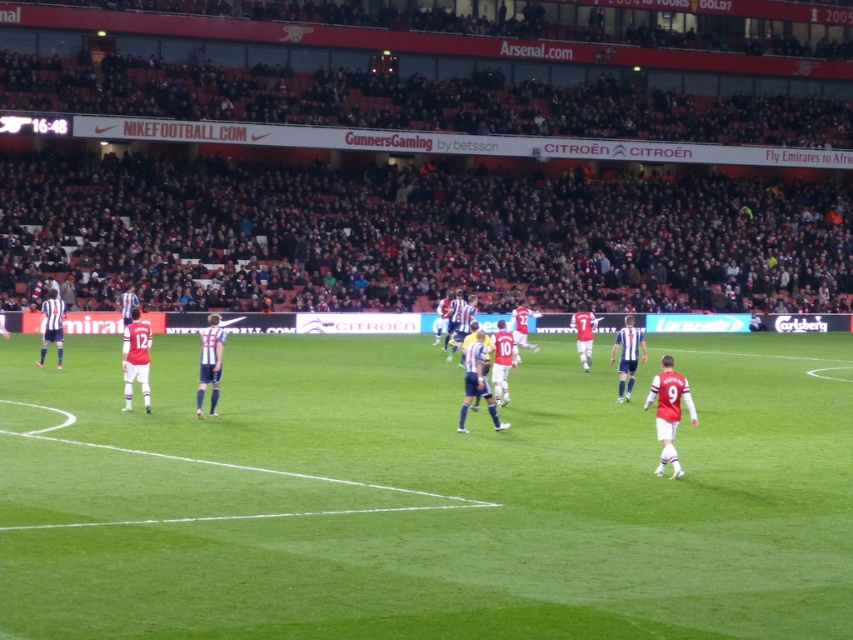
You are a photographer positioned at the edge of the soccer field. You want to take a photo of the white jersey at center without the dark gray crowd at upper center blocking the view. Is this possible based on their positions?

The dark gray crowd at upper center is further to the viewer than the white jersey at center, meaning the white jersey is closer to you. Therefore, you can take a photo of the white jersey at center without the crowd blocking the view because the crowd is behind the jersey from your perspective.

You are a drone operator trying to capture a shot of the soccer match. You need to ensure that both the green grass football field at center and the dark gray crowd at upper center are visible in your frame. Based on their positions, which object should appear closer to the camera in your photo?

The green grass football field at center appears closer to the camera because it is positioned in front of the dark gray crowd at upper center.

You are a drone operator trying to capture aerial footage of the soccer match. Your drone is currently hovering above the green grass football field at center. To get a better shot of the dark gray crowd at upper center, should you fly your drone upwards or downwards?

The green grass football field at center is positioned under the dark gray crowd at upper center, so to capture the crowd, you should fly the drone upwards.